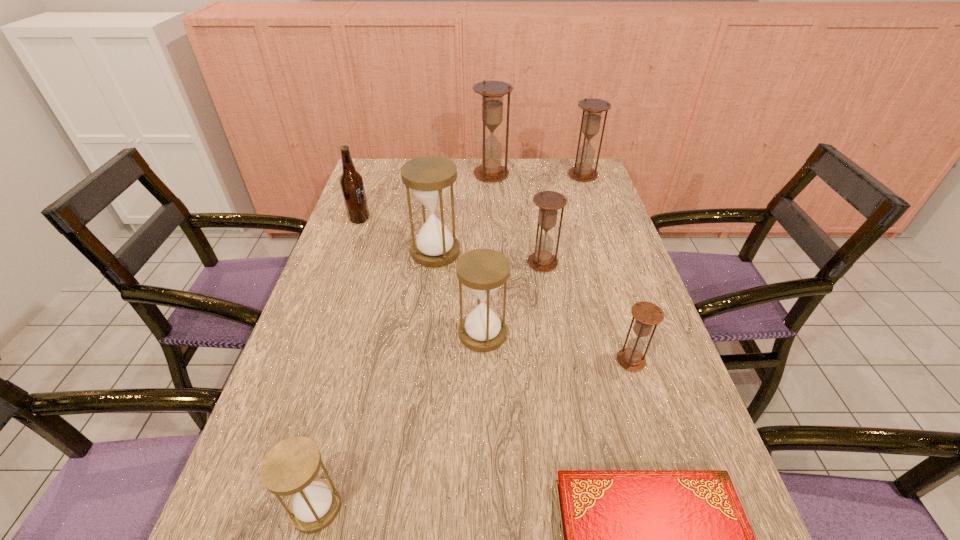
Locate an element on the screen. The image size is (960, 540). brown hourglass that can be found as the closest to the third smallest brown hourglass is located at coordinates (492, 92).

The width and height of the screenshot is (960, 540). I want to click on brown hourglass that is the third nearest to the tallest object, so click(x=647, y=314).

Image resolution: width=960 pixels, height=540 pixels. I want to click on white hourglass that is the second closest one to the second brown hourglass from left to right, so click(429, 177).

Select which white hourglass is the second closest to the third hourglass from right to left. Please provide its 2D coordinates. Your answer should be formatted as a tuple, i.e. [(x, y)], where the tuple contains the x and y coordinates of a point satisfying the conditions above.

[(429, 177)]

The image size is (960, 540). In order to click on free location that satisfies the following two spatial constraints: 1. on the back side of the second biggest brown hourglass; 2. on the right side of the seventh object from right to left in this screenshot , I will do (444, 176).

The height and width of the screenshot is (540, 960). Find the location of `vacant space that satisfies the following two spatial constraints: 1. on the label of the seventh nearest object; 2. on the back side of the rightmost white hourglass`. vacant space that satisfies the following two spatial constraints: 1. on the label of the seventh nearest object; 2. on the back side of the rightmost white hourglass is located at coordinates (319, 334).

I want to click on free point that satisfies the following two spatial constraints: 1. on the label of the third farthest object; 2. on the back side of the eighth object from right to left, so click(257, 507).

Locate an element on the screen. Image resolution: width=960 pixels, height=540 pixels. vacant space that satisfies the following two spatial constraints: 1. on the front side of the tallest object; 2. on the left side of the third smallest brown hourglass is located at coordinates (492, 176).

I want to click on free space that satisfies the following two spatial constraints: 1. on the label of the seventh nearest object; 2. on the right side of the second white hourglass from left to right, so click(348, 252).

Find the location of a particular element. The width and height of the screenshot is (960, 540). blank area in the image that satisfies the following two spatial constraints: 1. on the back side of the smallest white hourglass; 2. on the left side of the smallest brown hourglass is located at coordinates (354, 361).